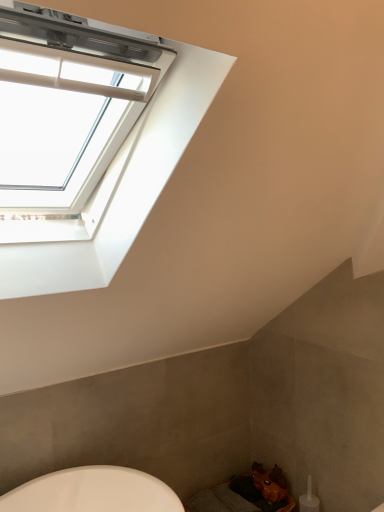
The image size is (384, 512). Describe the element at coordinates (122, 186) in the screenshot. I see `white plastic window at upper left` at that location.

This screenshot has width=384, height=512. Identify the location of white plastic window at upper left. (122, 186).

You are a GUI agent. You are given a task and a screenshot of the screen. Output one action in this format:
    pyautogui.click(x=<x>, y=<y>)
    Task: Click on the white plastic window at upper left
    
    Given the screenshot: What is the action you would take?
    pyautogui.click(x=122, y=186)